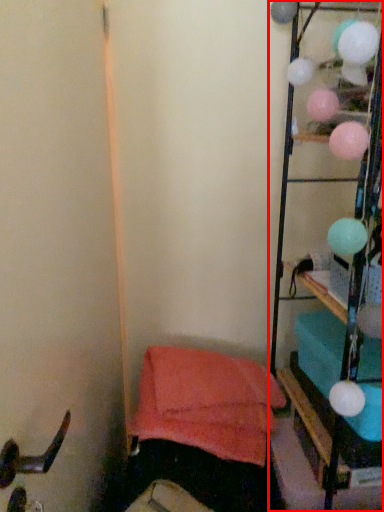
Question: In this image, where is furniture (annotated by the red box) located relative to bean bag chair?

Choices:
 (A) left
 (B) right

Answer: (B)